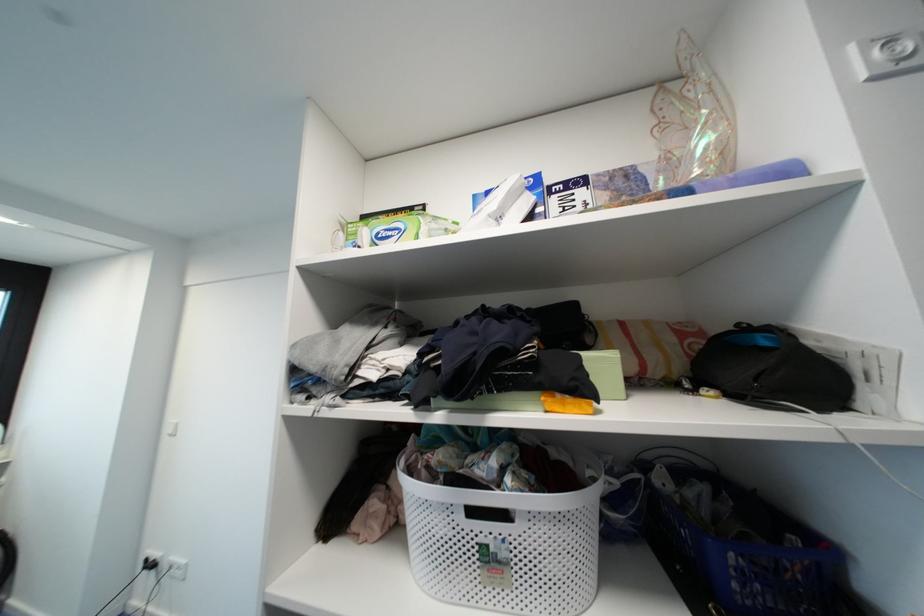
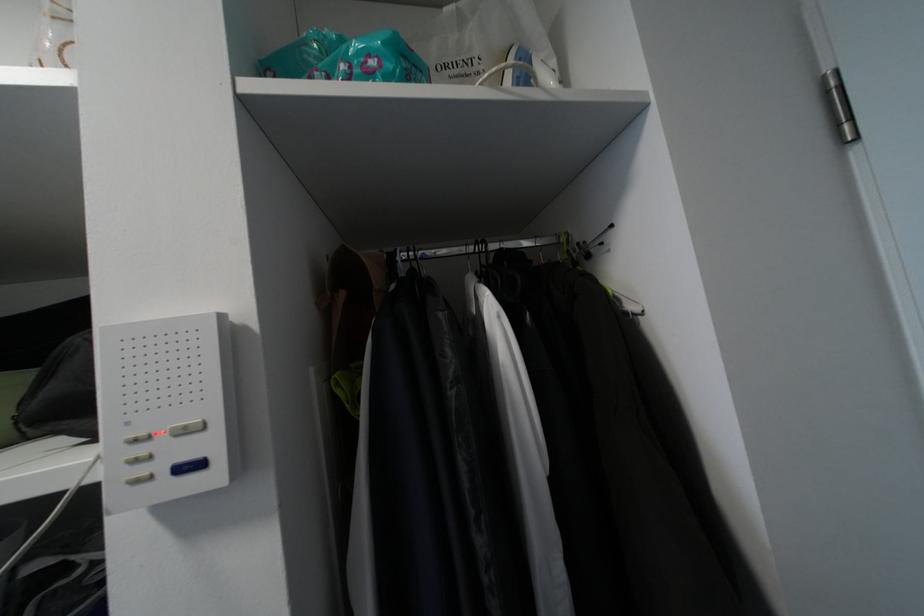
Question: The camera is either moving clockwise (left) or counter-clockwise (right) around the object. The first image is from the beginning of the video and the second image is from the end. Is the camera moving left or right when shooting the video?

Choices:
 (A) Left
 (B) Right

Answer: (A)